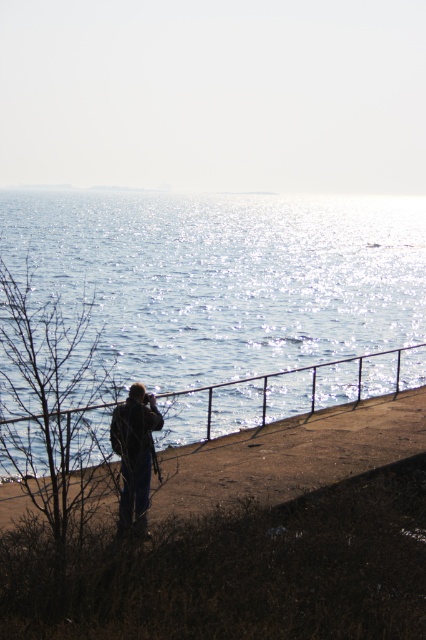
Question: Observing the image, what is the correct spatial positioning of glistening blue water at center in reference to brown dirt at lower left?

Choices:
 (A) above
 (B) below

Answer: (A)

Question: Which of these objects is positioned closest to the dark blue jeans at lower left?

Choices:
 (A) glistening blue water at center
 (B) brown dirt at lower left

Answer: (B)

Question: Which object appears closest to the camera in this image?

Choices:
 (A) glistening blue water at center
 (B) brown dirt at lower left

Answer: (A)

Question: Does glistening blue water at center have a lesser width compared to dark blue jeans at lower left?

Choices:
 (A) no
 (B) yes

Answer: (A)

Question: Is glistening blue water at center positioned at the back of brown dirt at lower left?

Choices:
 (A) no
 (B) yes

Answer: (A)

Question: Considering the real-world distances, which object is closest to the glistening blue water at center?

Choices:
 (A) dark blue jeans at lower left
 (B) brown dirt at lower left

Answer: (A)